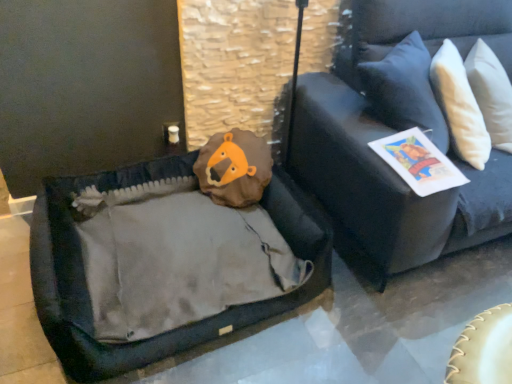
You are a GUI agent. You are given a task and a screenshot of the screen. Output one action in this format:
    pyautogui.click(x=<x>, y=<y>)
    Task: Click on the white paper magazine at upper right
    This screenshot has width=512, height=384.
    Given the screenshot: What is the action you would take?
    click(418, 162)

Measure the distance between point (406,168) and camera.

Point (406,168) and camera are 1.46 meters apart.

What do you see at coordinates (418, 162) in the screenshot? I see `white paper magazine at upper right` at bounding box center [418, 162].

What is the approximate width of velvet dark blue couch at upper right?

velvet dark blue couch at upper right is 51.46 centimeters in width.

You are a GUI agent. You are given a task and a screenshot of the screen. Output one action in this format:
    pyautogui.click(x=<x>, y=<y>)
    Task: Click on the velvet dark blue couch at upper right
    This screenshot has height=384, width=512.
    Given the screenshot: What is the action you would take?
    pyautogui.click(x=397, y=131)

Image resolution: width=512 pixels, height=384 pixels. Describe the element at coordinates (397, 131) in the screenshot. I see `velvet dark blue couch at upper right` at that location.

At what (x,y) coordinates should I click in order to perform the action: click on white paper magazine at upper right. Please return your answer as a coordinate pair (x, y). This screenshot has height=384, width=512. Looking at the image, I should click on (418, 162).

In the scene shown: Between white paper magazine at upper right and velvet dark blue couch at upper right, which one appears on the right side from the viewer's perspective?

Positioned to the right is velvet dark blue couch at upper right.

Which object is closer to the camera taking this photo, white paper magazine at upper right or velvet dark blue couch at upper right?

velvet dark blue couch at upper right is closer to the camera.

Is point (445, 185) positioned in front of point (380, 237)?

Yes.

From the image's perspective, between white paper magazine at upper right and velvet dark blue couch at upper right, who is located below?

white paper magazine at upper right.

From the picture: From a real-world perspective, is white paper magazine at upper right on velvet dark blue couch at upper right?

No, from a real-world perspective, white paper magazine at upper right is not on top of velvet dark blue couch at upper right.

Which of these two, white paper magazine at upper right or velvet dark blue couch at upper right, is wider?

With larger width is velvet dark blue couch at upper right.

Does white paper magazine at upper right have a lesser height compared to velvet dark blue couch at upper right?

Yes, white paper magazine at upper right is shorter than velvet dark blue couch at upper right.

Which of these two, white paper magazine at upper right or velvet dark blue couch at upper right, is smaller?

white paper magazine at upper right is smaller.

Is white paper magazine at upper right not within velvet dark blue couch at upper right?

No, most part of white paper magazine at upper right lies within velvet dark blue couch at upper right.

Is white paper magazine at upper right directly adjacent to velvet dark blue couch at upper right?

white paper magazine at upper right and velvet dark blue couch at upper right are clearly separated.

Is white paper magazine at upper right oriented away from velvet dark blue couch at upper right?

Yes, velvet dark blue couch at upper right is at the back of white paper magazine at upper right.

How many degrees apart are the facing directions of white paper magazine at upper right and velvet dark blue couch at upper right?

They differ by 28.8 degrees in their facing directions.

Measure the distance between white paper magazine at upper right and velvet dark blue couch at upper right.

26.64 centimeters.

Find the location of a particular element. magazine behind the velvet dark blue couch at upper right is located at coordinates (418, 162).

Considering the relative positions of velvet dark blue couch at upper right and white paper magazine at upper right in the image provided, is velvet dark blue couch at upper right to the left of white paper magazine at upper right from the viewer's perspective?

No.

Considering the positions of objects velvet dark blue couch at upper right and white paper magazine at upper right in the image provided, who is behind, velvet dark blue couch at upper right or white paper magazine at upper right?

white paper magazine at upper right is further from the camera.

Considering the positions of point (323, 182) and point (462, 173), is point (323, 182) closer or farther from the camera than point (462, 173)?

Clearly, point (323, 182) is more distant from the camera than point (462, 173).

Based on the photo, from the image's perspective, between velvet dark blue couch at upper right and white paper magazine at upper right, who is located below?

white paper magazine at upper right.

Looking at this image, from a real-world perspective, which object stands above the other?

From a 3D spatial view, velvet dark blue couch at upper right is above.

Which of these two, velvet dark blue couch at upper right or white paper magazine at upper right, is wider?

With larger width is velvet dark blue couch at upper right.

Is velvet dark blue couch at upper right taller or shorter than white paper magazine at upper right?

In the image, velvet dark blue couch at upper right appears to be taller than white paper magazine at upper right.

In terms of size, does velvet dark blue couch at upper right appear bigger or smaller than white paper magazine at upper right?

In the image, velvet dark blue couch at upper right appears to be larger than white paper magazine at upper right.

Is velvet dark blue couch at upper right not inside white paper magazine at upper right?

Indeed, velvet dark blue couch at upper right is completely outside white paper magazine at upper right.

From the picture: Are velvet dark blue couch at upper right and white paper magazine at upper right beside each other?

No, velvet dark blue couch at upper right is not with white paper magazine at upper right.

Does velvet dark blue couch at upper right turn towards white paper magazine at upper right?

No.

How different are the orientations of velvet dark blue couch at upper right and white paper magazine at upper right in degrees?

velvet dark blue couch at upper right and white paper magazine at upper right are facing 28.8 degrees away from each other.

Where is `studio couch in front of the white paper magazine at upper right`? studio couch in front of the white paper magazine at upper right is located at coordinates (397, 131).

Identify the location of studio couch lying on the right of white paper magazine at upper right. The height and width of the screenshot is (384, 512). (397, 131).

What are the coordinates of `studio couch in front of the white paper magazine at upper right` in the screenshot? It's located at tap(397, 131).